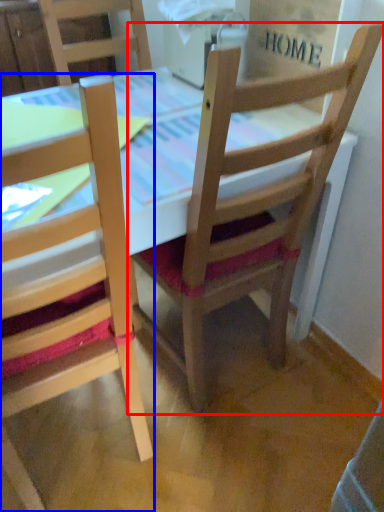
Question: Among these objects, which one is nearest to the camera, chair (highlighted by a red box) or chair (highlighted by a blue box)?

Choices:
 (A) chair
 (B) chair

Answer: (B)